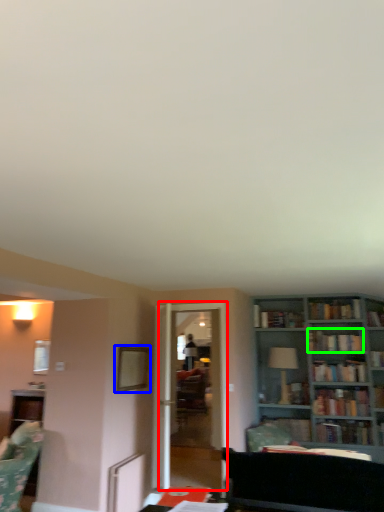
Question: Considering the real-world distances, which object is closest to glass door (highlighted by a red box)? picture frame (highlighted by a blue box) or book (highlighted by a green box).

Choices:
 (A) picture frame
 (B) book

Answer: (A)